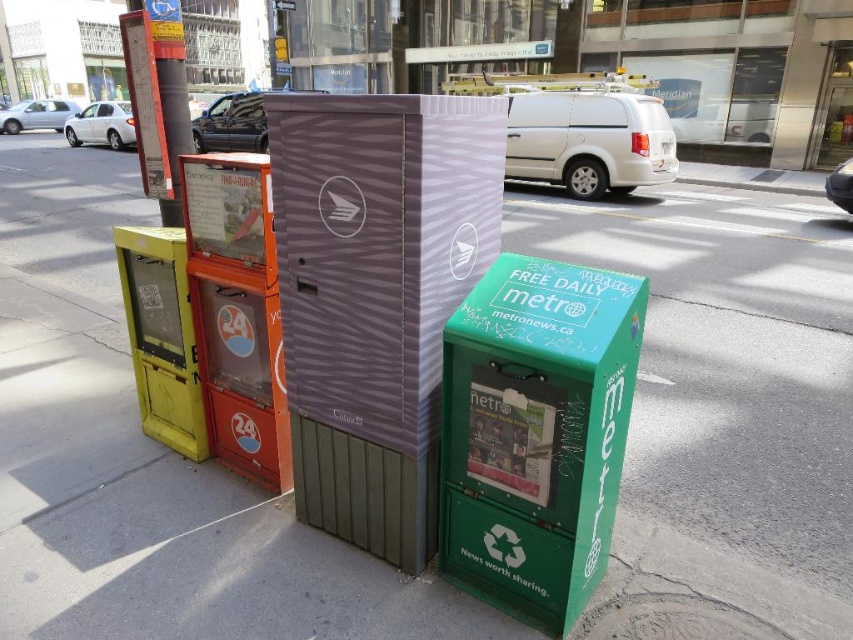
Question: Can you confirm if purple striped mailbox at center is positioned above green matte newspaper box at lower right?

Choices:
 (A) yes
 (B) no

Answer: (A)

Question: Is purple striped mailbox at center positioned at the back of green matte newspaper box at lower right?

Choices:
 (A) no
 (B) yes

Answer: (B)

Question: Among these objects, which one is farthest from the camera?

Choices:
 (A) purple striped mailbox at center
 (B) green matte newspaper box at lower right

Answer: (A)

Question: Does purple striped mailbox at center appear under green matte newspaper box at lower right?

Choices:
 (A) yes
 (B) no

Answer: (B)

Question: Which point is farther to the camera?

Choices:
 (A) (569, 410)
 (B) (413, 266)

Answer: (B)